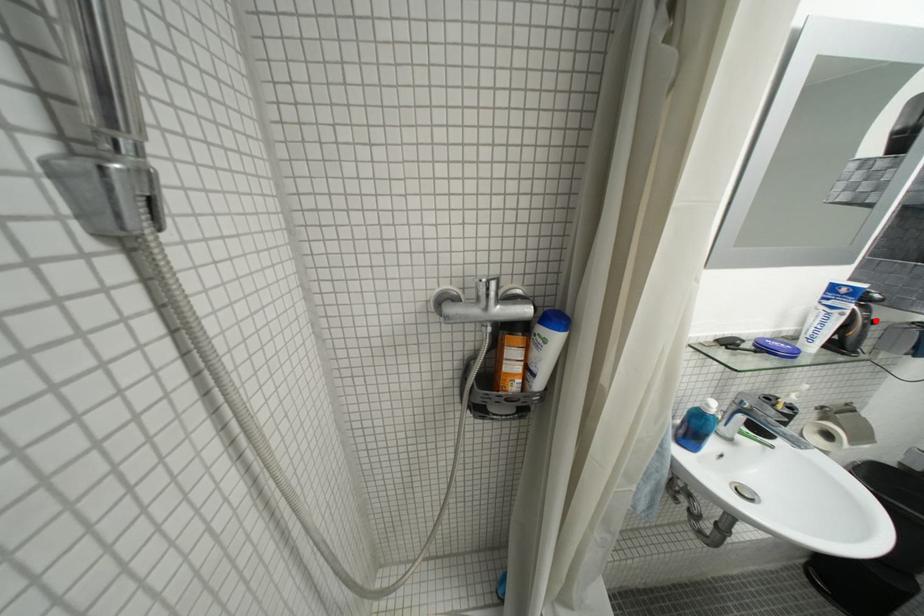
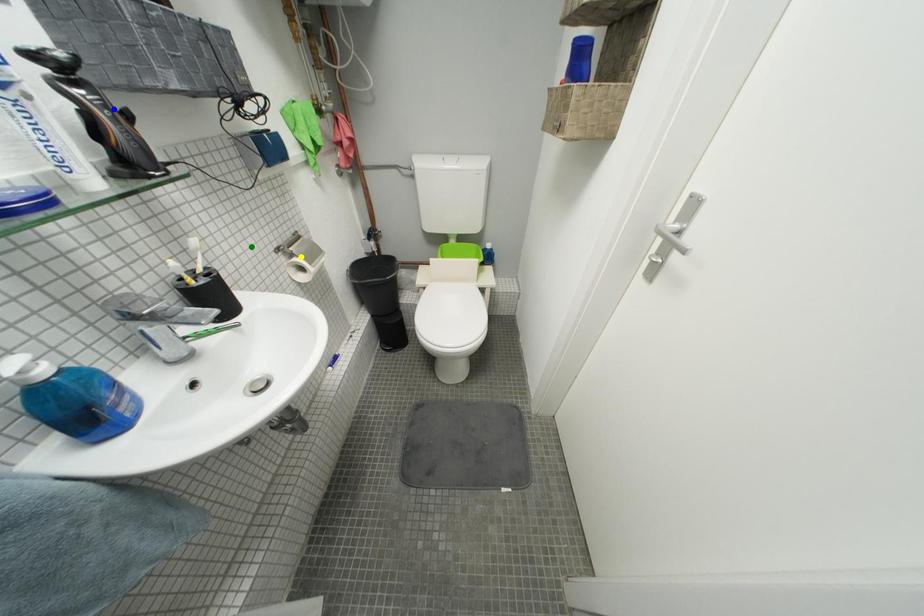
Question: I am providing you with two images of the same scene from different viewpoints. A red point is marked on the first image. You are given multiple points on the second image. Can you choose the point in image 2 that corresponds to the point in image 1?

Choices:
 (A) blue point
 (B) green point
 (C) yellow point

Answer: (A)